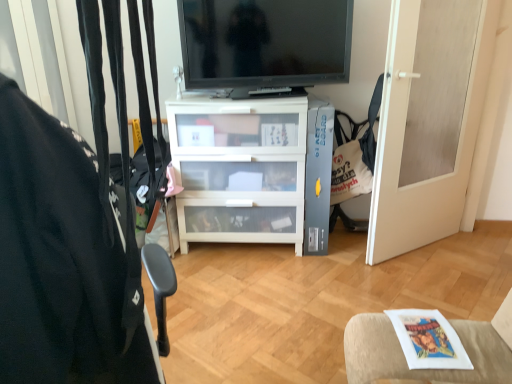
Locate an element on the screen. free spot above white fabric cushion at lower right (from a real-world perspective) is located at coordinates [421, 327].